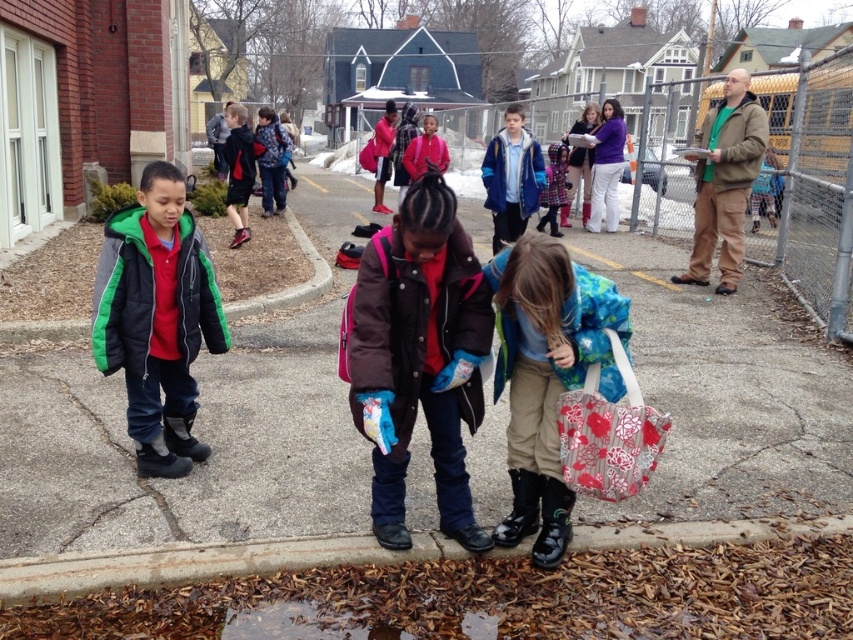
Question: Is translucent floral-patterned bag at lower center thinner than reddish-brown leather jacket at upper center?

Choices:
 (A) no
 (B) yes

Answer: (A)

Question: Is translucent floral-patterned bag at lower center further to camera compared to reddish-brown leather jacket at upper center?

Choices:
 (A) no
 (B) yes

Answer: (A)

Question: Estimate the real-world distances between objects in this image. Which object is closer to the translucent floral-patterned bag at lower center?

Choices:
 (A) brown concrete curb at lower center
 (B) green quilted jacket at left

Answer: (A)

Question: Estimate the real-world distances between objects in this image. Which object is farther from the paved asphalt at center?

Choices:
 (A) brown concrete curb at lower center
 (B) reddish-brown leather jacket at upper center
 (C) translucent floral-patterned bag at lower center
 (D) floral fabric bag at lower center

Answer: (B)

Question: Estimate the real-world distances between objects in this image. Which object is closer to the reddish-brown leather jacket at upper center?

Choices:
 (A) brown concrete curb at lower center
 (B) paved asphalt at center

Answer: (B)

Question: Does green quilted jacket at left have a lesser width compared to brown concrete curb at lower center?

Choices:
 (A) no
 (B) yes

Answer: (B)